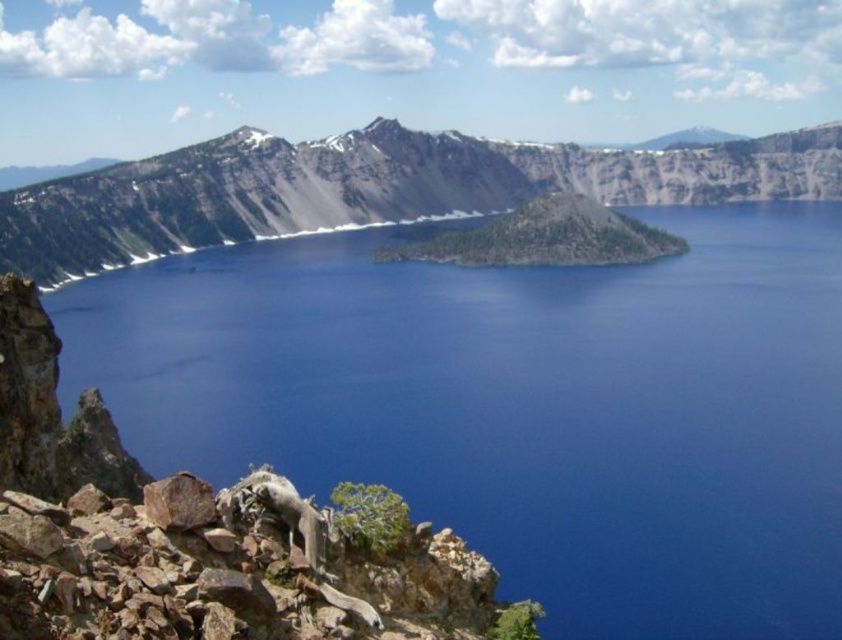
You are a hiker who wants to take a photo of the blue water at center and the gray rocky mountain at center. Which object should you frame first in your camera to ensure both are in the shot?

The blue water at center is positioned on the left side of gray rocky mountain at center, so you should frame the gray rocky mountain at center first to ensure both are in the shot.

You are standing at the edge of Crater Lake and notice the rusty rock at lower left and the gray rocky mountain at center. Which object is closer to your current position?

The rusty rock at lower left is closer to your current position because it is positioned under the gray rocky mountain at center, indicating it is in a lower elevation area.

You are standing at the edge of Crater Lake and see two points marked on the landscape. The first point is located at coordinates point (x=665, y=308), and the second point is at point (x=356, y=220). Which of these two points is nearer to your current position?

Point (x=665, y=308) is closer to the viewer than point (x=356, y=220), so the first point is nearer to your current position.